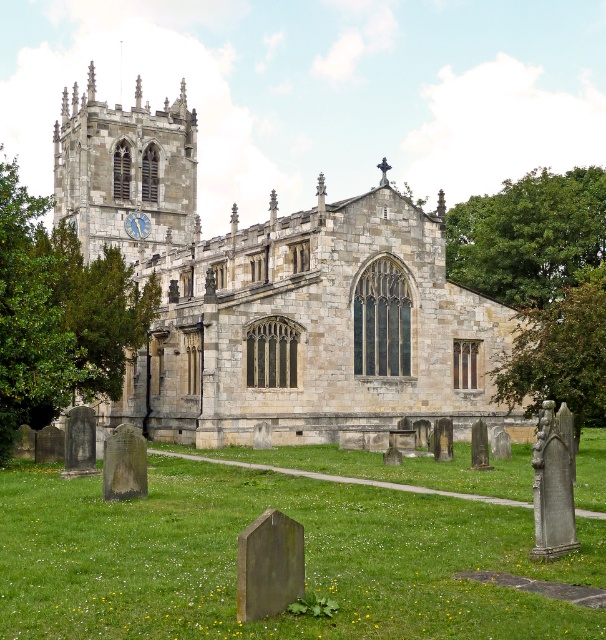
Question: Which of the following is the closest to the observer?

Choices:
 (A) (99, 161)
 (B) (510, 280)
 (C) (47, 349)

Answer: (C)

Question: Which point is farther to the camera?

Choices:
 (A) green leafy tree at upper right
 (B) stone church at center

Answer: (A)

Question: Can you confirm if green grass at lower center is positioned below green leafy tree at center?

Choices:
 (A) no
 (B) yes

Answer: (B)

Question: Considering the real-world distances, which object is farthest from the green leafy tree at center?

Choices:
 (A) green leafy tree at left
 (B) green leafy tree at upper right
 (C) green grass at lower center

Answer: (A)

Question: In this image, where is green grass at lower center located relative to green leafy tree at center?

Choices:
 (A) right
 (B) left

Answer: (B)

Question: Can you confirm if stone church at center is bigger than green leafy tree at center?

Choices:
 (A) no
 (B) yes

Answer: (B)